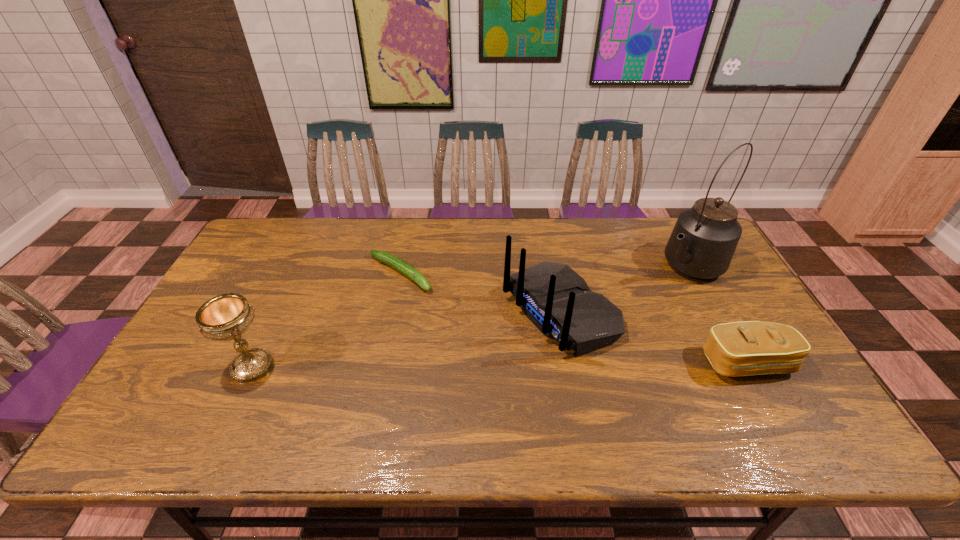
Find the location of a particular element. The image size is (960, 540). vacant space on the desktop that is between the leftmost object and the clutch bag and is positioned on the back of the third object from left to right is located at coordinates (449, 365).

At what (x,y) coordinates should I click in order to perform the action: click on free spot on the desktop that is between the chalice and the clutch bag and is positioned spout on the tallest object. Please return your answer as a coordinate pair (x, y). This screenshot has width=960, height=540. Looking at the image, I should click on (546, 364).

You are a GUI agent. You are given a task and a screenshot of the screen. Output one action in this format:
    pyautogui.click(x=<x>, y=<y>)
    Task: Click on the vacant spot on the desktop that is between the leftmost object and the second shortest object and is positioned on the front-facing side of the shortest object
    
    Given the screenshot: What is the action you would take?
    pyautogui.click(x=537, y=364)